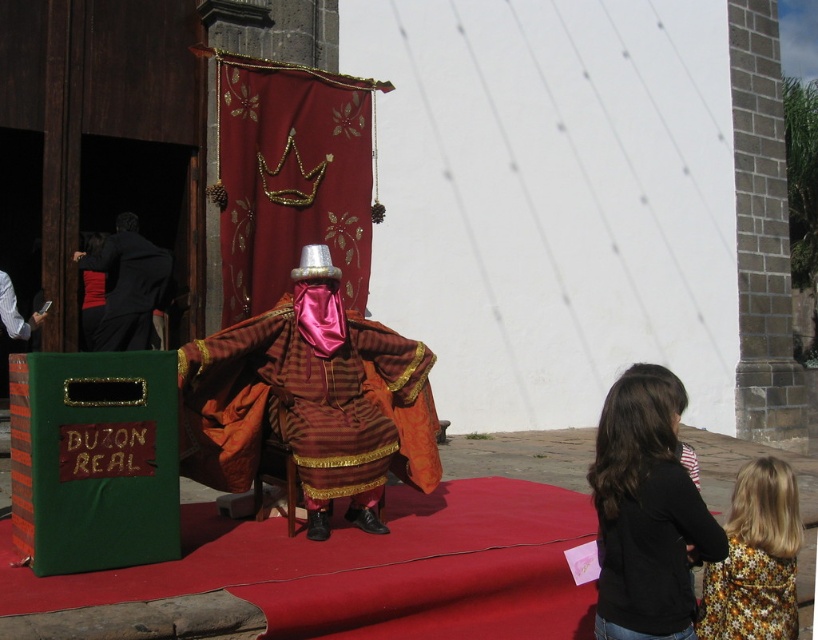
Between floral fabric dress at lower right and black velvet robe at left, which one is positioned higher?

Positioned higher is black velvet robe at left.

Which is behind, point (712, 637) or point (106, 337)?

Point (106, 337)

Who is more distant from viewer, (727, 550) or (115, 304)?

The point (115, 304) is more distant.

Where is `floral fabric dress at lower right`? The height and width of the screenshot is (640, 818). floral fabric dress at lower right is located at coordinates (754, 560).

Who is shorter, shiny silk robe at center or velvet black dress at left?

Standing shorter between the two is velvet black dress at left.

Does shiny silk robe at center have a lesser height compared to velvet black dress at left?

No, shiny silk robe at center is not shorter than velvet black dress at left.

Find the location of a particular element. The width and height of the screenshot is (818, 640). shiny silk robe at center is located at coordinates (308, 404).

Can you confirm if black velvet robe at left is taller than velvet black dress at left?

Yes, black velvet robe at left is taller than velvet black dress at left.

Can you confirm if black velvet robe at left is positioned above velvet black dress at left?

Yes.

Is point (142, 266) positioned after point (92, 282)?

No, it is not.

Find the location of a particular element. This screenshot has height=640, width=818. black velvet robe at left is located at coordinates (127, 285).